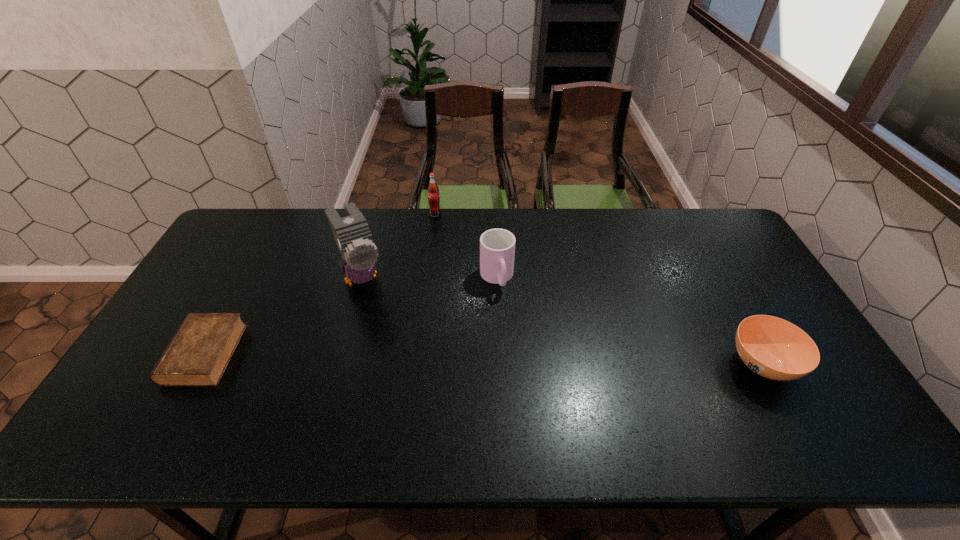
Find the location of a particular element. This screenshot has height=540, width=960. vacant space situated 0.310m with the handle on the side of the cup is located at coordinates (526, 383).

Identify the location of bird at the far edge. (353, 237).

I want to click on soda bottle positioned at the far edge, so click(x=433, y=191).

Find the location of a particular element. The image size is (960, 540). diary at the near edge is located at coordinates (198, 354).

The width and height of the screenshot is (960, 540). What are the coordinates of `soup bowl present at the near edge` in the screenshot? It's located at (774, 348).

The width and height of the screenshot is (960, 540). Identify the location of object present at the left edge. (198, 354).

Identify the location of object that is positioned at the right edge. The image size is (960, 540). (774, 348).

This screenshot has height=540, width=960. I want to click on object that is at the near left corner, so click(x=198, y=354).

Identify the location of object that is at the near right corner. (774, 348).

This screenshot has width=960, height=540. In the image, there is a desktop. Find the location of `vacant space at the far edge`. vacant space at the far edge is located at coordinates (377, 227).